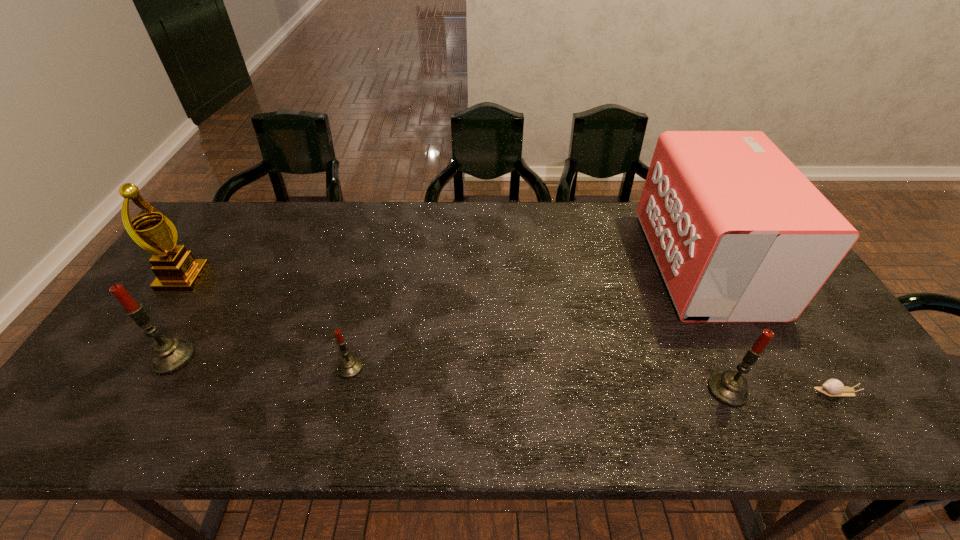
You are a GUI agent. You are given a task and a screenshot of the screen. Output one action in this format:
    pyautogui.click(x=<x>, y=<y>)
    Task: Click on the vacant region at the right edge
    This screenshot has width=960, height=540.
    Given the screenshot: What is the action you would take?
    pyautogui.click(x=815, y=329)

Image resolution: width=960 pixels, height=540 pixels. In the image, there is a desktop. In order to click on vacant space at the far left corner in this screenshot , I will do `click(258, 206)`.

In the image, there is a desktop. Identify the location of vacant space at the near left corner. (144, 372).

You are a GUI agent. You are given a task and a screenshot of the screen. Output one action in this format:
    pyautogui.click(x=<x>, y=<y>)
    Task: Click on the blank region between the shortest object and the award
    
    Given the screenshot: What is the action you would take?
    pyautogui.click(x=510, y=335)

This screenshot has height=540, width=960. Find the location of `unoccupied position between the leftmost candle and the fourth tallest object`. unoccupied position between the leftmost candle and the fourth tallest object is located at coordinates (450, 374).

Locate an element on the screen. vacant area that lies between the leftmost candle and the box is located at coordinates (439, 310).

This screenshot has width=960, height=540. I want to click on vacant point located between the fourth tallest object and the third object from left to right, so click(539, 379).

Where is `vacant point located between the box and the fourth tallest object`? This screenshot has height=540, width=960. vacant point located between the box and the fourth tallest object is located at coordinates (716, 327).

This screenshot has height=540, width=960. What are the coordinates of `free space between the second candle from left to right and the fourth tallest object` in the screenshot? It's located at (539, 379).

Where is `empty space between the box and the award`? The image size is (960, 540). empty space between the box and the award is located at coordinates (444, 271).